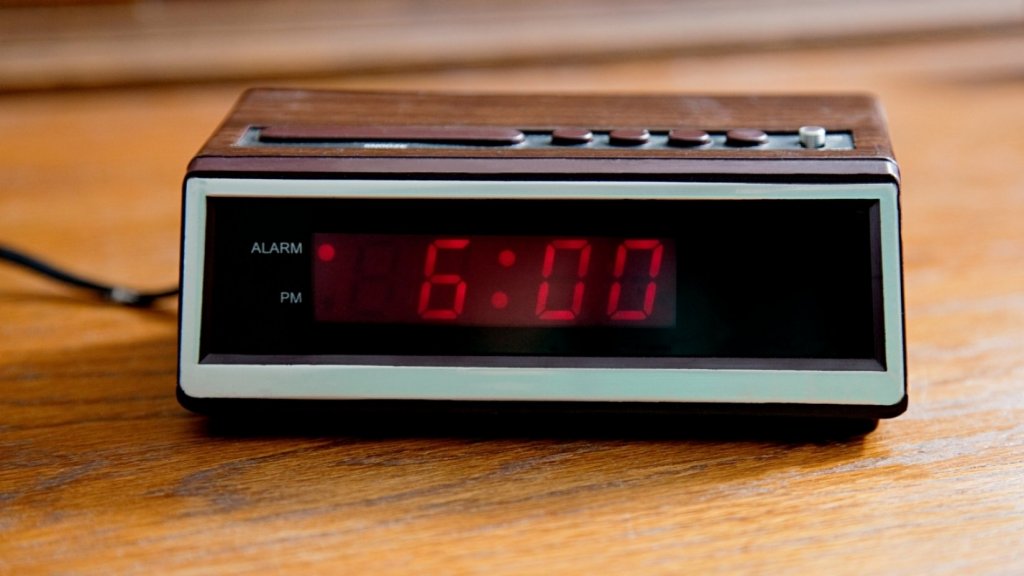
The height and width of the screenshot is (576, 1024). I want to click on rectangular alarm clock, so click(x=257, y=100).